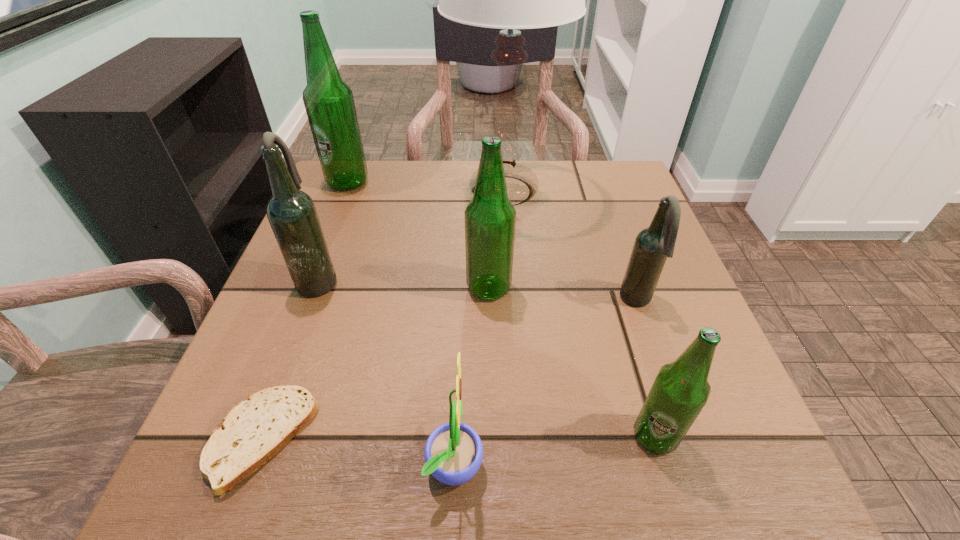
Identify the location of object at the near right corner. (680, 391).

At what (x,y) coordinates should I click in order to perform the action: click on vacant space at the far edge. Please return your answer as a coordinate pair (x, y). Looking at the image, I should click on (444, 164).

At what (x,y) coordinates should I click in order to perform the action: click on free space at the near edge. Please return your answer as a coordinate pair (x, y). Looking at the image, I should click on (624, 460).

Where is `free space at the left edge of the desktop`? The image size is (960, 540). free space at the left edge of the desktop is located at coordinates (270, 376).

Find the location of a particular element. This screenshot has height=540, width=960. free space at the right edge is located at coordinates (609, 233).

Locate an element on the screen. blank space at the far left corner is located at coordinates 372,160.

Image resolution: width=960 pixels, height=540 pixels. What are the coordinates of `vacant area at the far right corner of the desktop` in the screenshot? It's located at (621, 184).

Locate an element on the screen. This screenshot has width=960, height=540. free space between the sunflower and the second green beer bottle from right to left is located at coordinates (472, 375).

Locate an element on the screen. The width and height of the screenshot is (960, 540). free space between the bigger dark beer bottle and the sunflower is located at coordinates (387, 370).

At what (x,y) coordinates should I click in order to perform the action: click on vacant point located between the table lamp and the shortest object. Please return your answer as a coordinate pair (x, y). The height and width of the screenshot is (540, 960). Looking at the image, I should click on (382, 315).